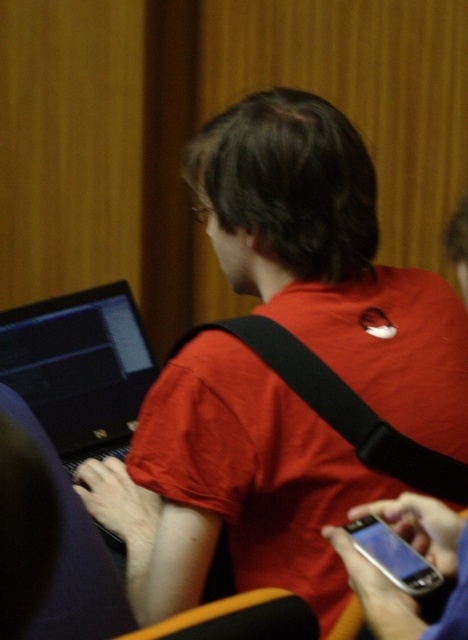
Question: Can you confirm if black glossy laptop at left is bigger than silver metallic smartphone at lower right?

Choices:
 (A) no
 (B) yes

Answer: (B)

Question: Which point is closer to the camera?

Choices:
 (A) black glossy laptop at left
 (B) silver metallic smartphone at lower right

Answer: (B)

Question: Is the position of black glossy laptop at left less distant than that of silver metallic smartphone at lower right?

Choices:
 (A) yes
 (B) no

Answer: (B)

Question: Which point is farther to the camera?

Choices:
 (A) black glossy laptop at left
 (B) silver metallic smartphone at lower right

Answer: (A)

Question: Among these points, which one is nearest to the camera?

Choices:
 (A) (380, 528)
 (B) (117, 410)

Answer: (A)

Question: Can you confirm if black glossy laptop at left is positioned to the right of silver metallic smartphone at lower right?

Choices:
 (A) no
 (B) yes

Answer: (A)